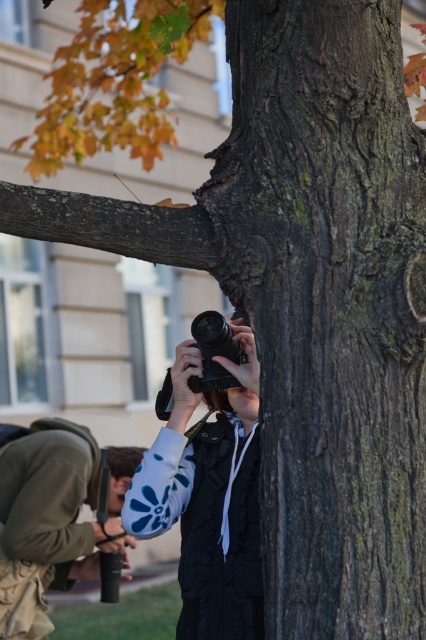
Can you confirm if black matte camera at center is positioned below denim jacket at lower left?

Actually, black matte camera at center is above denim jacket at lower left.

Is black matte camera at center to the right of denim jacket at lower left from the viewer's perspective?

Indeed, black matte camera at center is positioned on the right side of denim jacket at lower left.

Measure the distance between point (198, 401) and camera.

A distance of 11.38 feet exists between point (198, 401) and camera.

Identify the location of black matte camera at center. (207, 497).